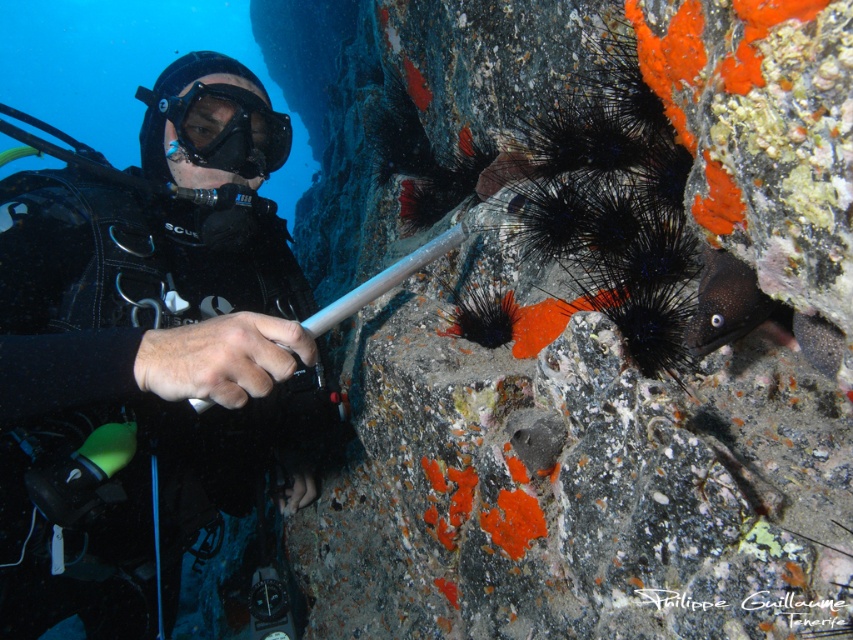
You are a marine biologist observing the underwater scene. You need to determine the visibility of the black matte diving suit at left and the transparent rubber goggles at center. Which object is closer to you?

The black matte diving suit at left is closer to the viewer than the transparent rubber goggles at center.

You are an underwater photographer. You need to position your camera between the black matte diving suit at left and the transparent rubber goggles at center. Which side should you place the camera to ensure it fits without overlapping either object?

The black matte diving suit at left is wider than the transparent rubber goggles at center. To fit the camera between them without overlapping, place it closer to the transparent rubber goggles at center since there is more space on that side.

You are a marine biologist examining the underwater scene. You need to determine which object is larger between the black matte diving suit at left and the transparent rubber goggles at center. Based on the scene, which one is bigger?

The black matte diving suit at left is bigger than the transparent rubber goggles at center.